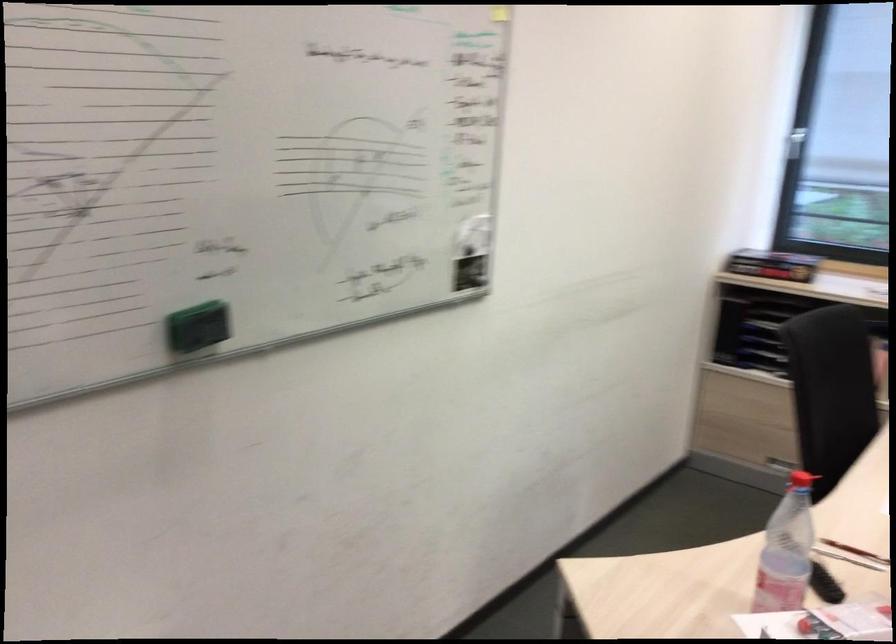
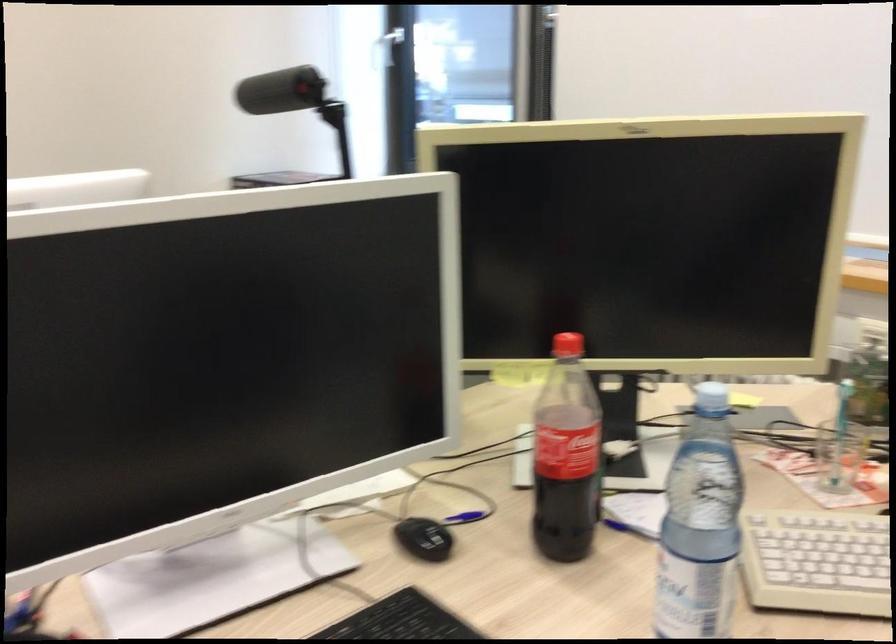
Question: What movement of the cameraman would produce the second image?

Choices:
 (A) Left
 (B) Right
 (C) Forward
 (D) Backward

Answer: (B)